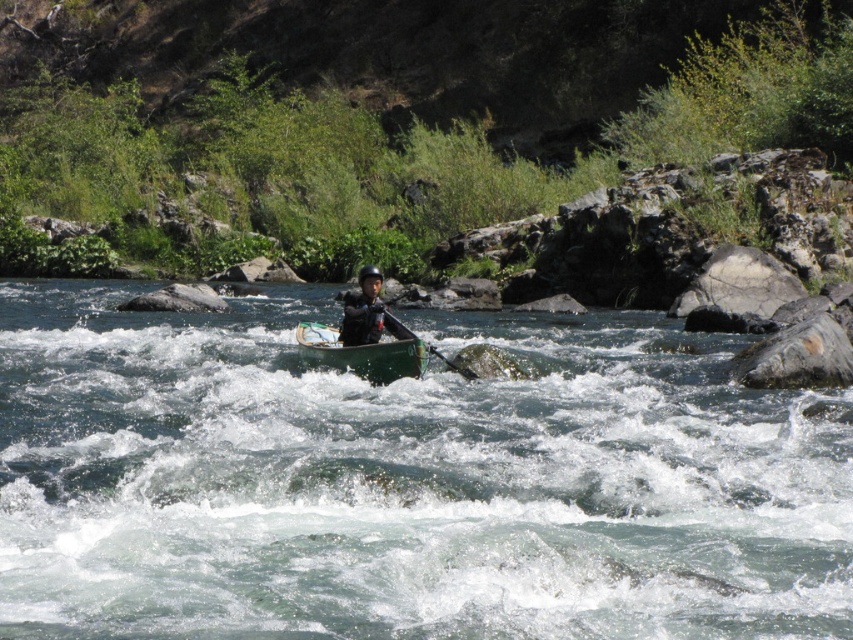
You are a photographer planning to take a photo of the green wood canoe at center and the green plastic paddle at center. From the perspective of someone standing on the riverbank, which object should you focus on first if you want to capture both in a single frame? Explain your reasoning based on their positions.

The green wood canoe at center is positioned on the right side of the green plastic paddle at center. To capture both in a single frame, you should focus on the green plastic paddle at center first since it is on the left, allowing the photographer to frame the scene starting from the left object and expanding to include the right object without cropping either out.

You are a photographer positioned at the edge of the river. You want to capture a photo of the green plastic canoe at center and the matte black helmet at center. Which object should you focus on first if you want to ensure both are in sharp focus?

The green plastic canoe at center is in front of the matte black helmet at center. To ensure both are in sharp focus, you should focus on the matte black helmet at center since it is farther away, allowing the depth of field to cover the closer canoe as well.

You are a photographer positioned at the edge of the riverbank. You want to capture a photo of the green wood canoe at center and the matte black helmet at center. Which object is wider in the image?

The green wood canoe at center is wider than the matte black helmet at center.